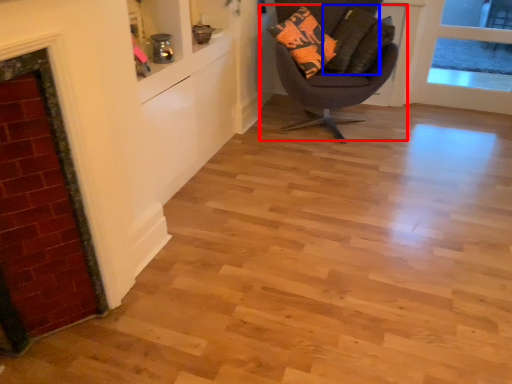
Question: Which of the following is the closest to the observer, chair (highlighted by a red box) or pillow (highlighted by a blue box)?

Choices:
 (A) chair
 (B) pillow

Answer: (A)